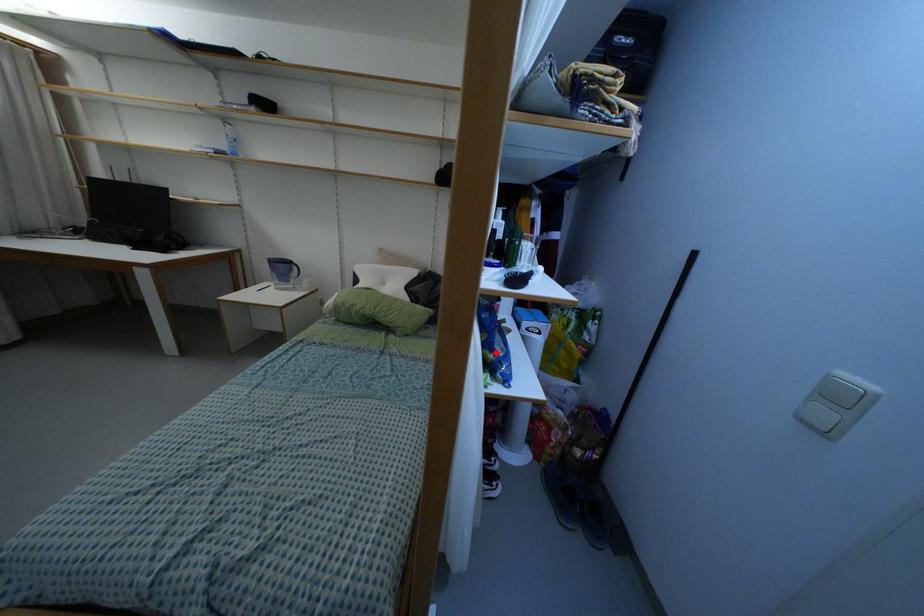
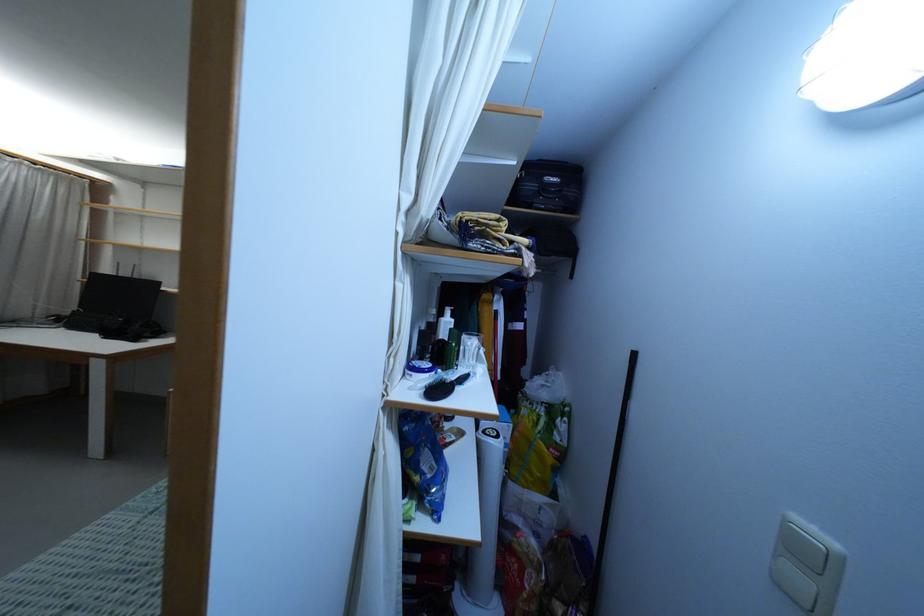
The point at the highlighted location is marked in the first image. Where is the corresponding point in the second image?

(422, 474)